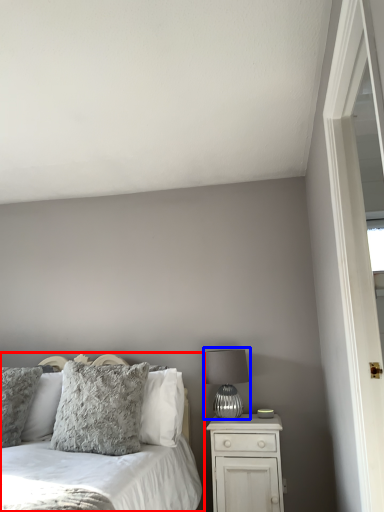
Question: Which object appears farthest to the camera in this image, bed (highlighted by a red box) or table lamp (highlighted by a blue box)?

Choices:
 (A) bed
 (B) table lamp

Answer: (B)